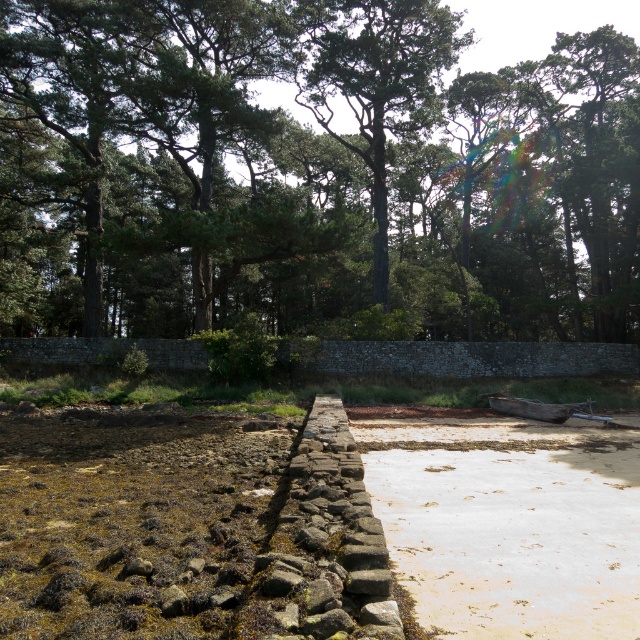
You are standing on the stone pathway and want to look at the green leafy trees at upper center and the weathered wood canoe at center. Which object is higher in the scene?

The green leafy trees at upper center are positioned over the weathered wood canoe at center, so they are higher in the scene.